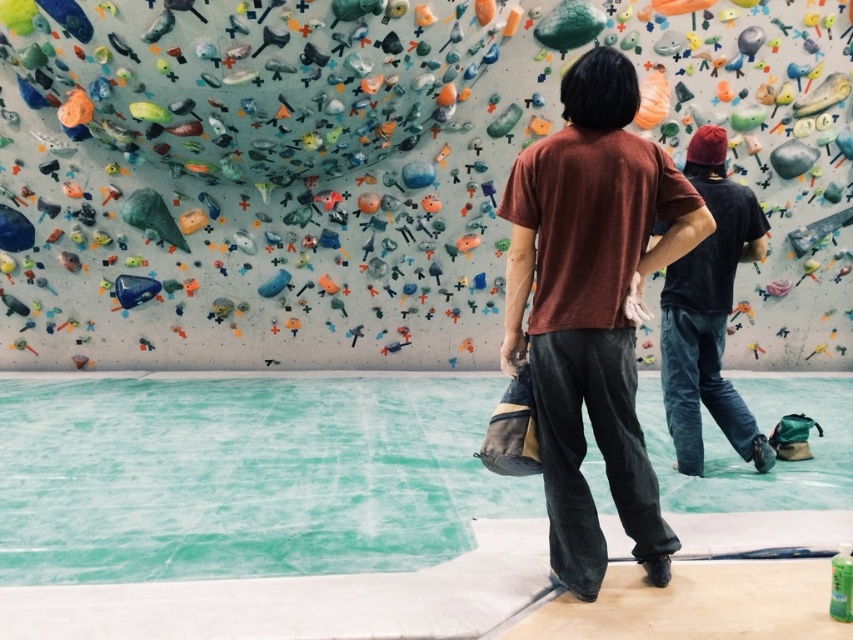
Which is in front, point (625, 396) or point (728, 241)?

Point (625, 396) is in front.

Between brown cotton t-shirt at center and dark blue jeans at center, which one is positioned lower?

Positioned lower is brown cotton t-shirt at center.

Measure the distance between brown cotton t-shirt at center and camera.

6.91 feet

Where is `brown cotton t-shirt at center`? This screenshot has height=640, width=853. brown cotton t-shirt at center is located at coordinates (592, 307).